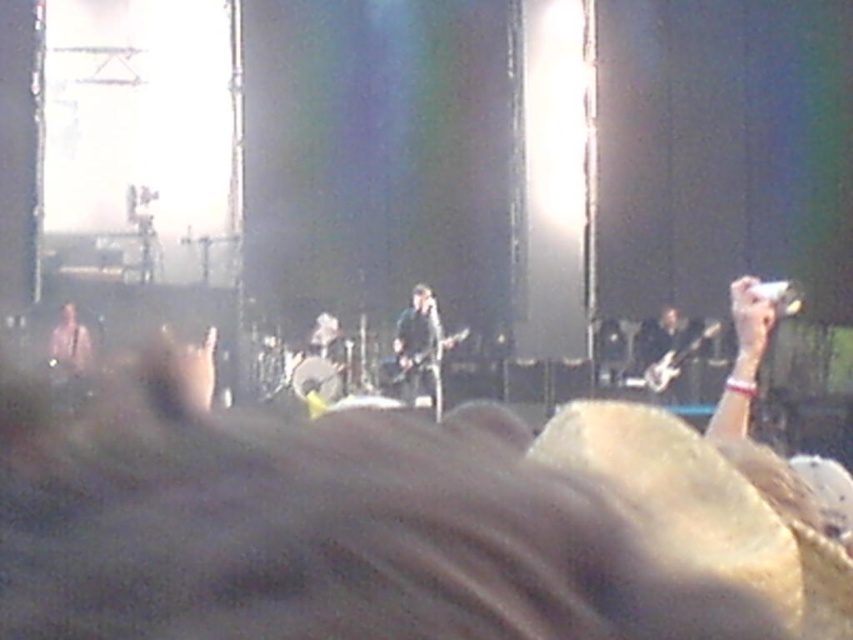
What do you see at coordinates (421, 348) in the screenshot?
I see `shiny black guitar at center` at bounding box center [421, 348].

Can you confirm if shiny black guitar at center is positioned above matte black guitar at left?

Actually, shiny black guitar at center is below matte black guitar at left.

What are the coordinates of `shiny black guitar at center` in the screenshot? It's located at (421, 348).

You are a GUI agent. You are given a task and a screenshot of the screen. Output one action in this format:
    pyautogui.click(x=<x>, y=<y>)
    Task: Click on the shiny black guitar at center
    This screenshot has width=853, height=640.
    Given the screenshot: What is the action you would take?
    pyautogui.click(x=421, y=348)